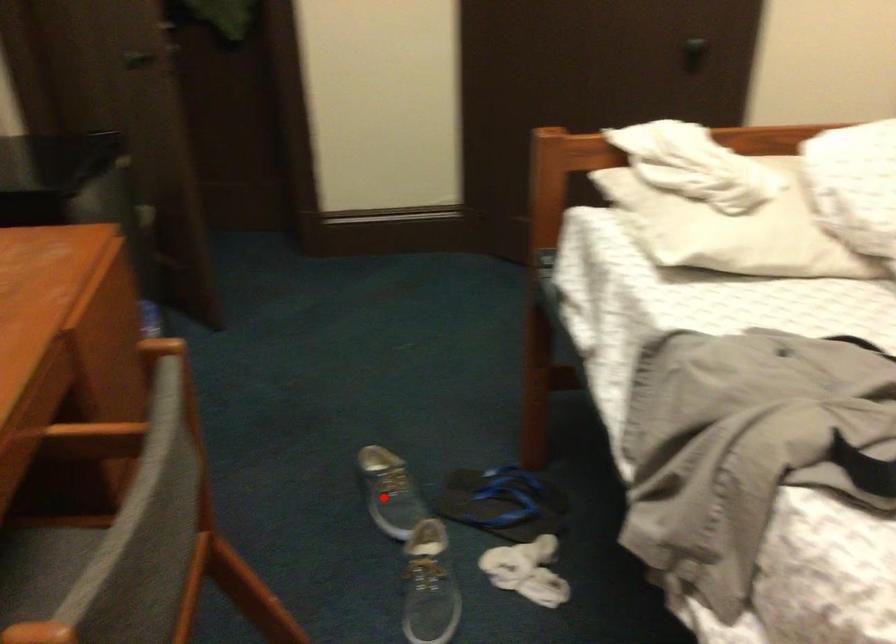
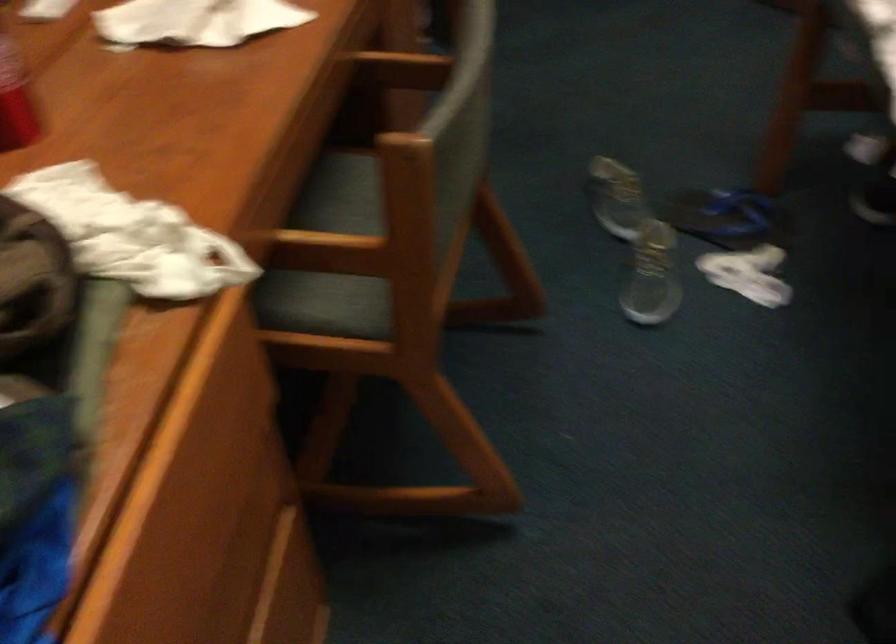
Where in the second image is the point corresponding to the highlighted location from the first image?

(616, 198)